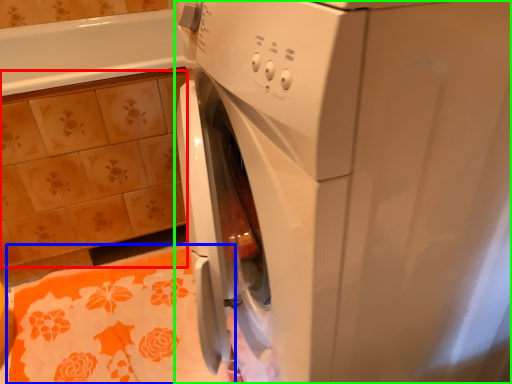
Question: Which object is positioned farthest from ceramic tile (highlighted by a red box)? Select from bath towel (highlighted by a blue box) and washing machine (highlighted by a green box).

Choices:
 (A) bath towel
 (B) washing machine

Answer: (B)